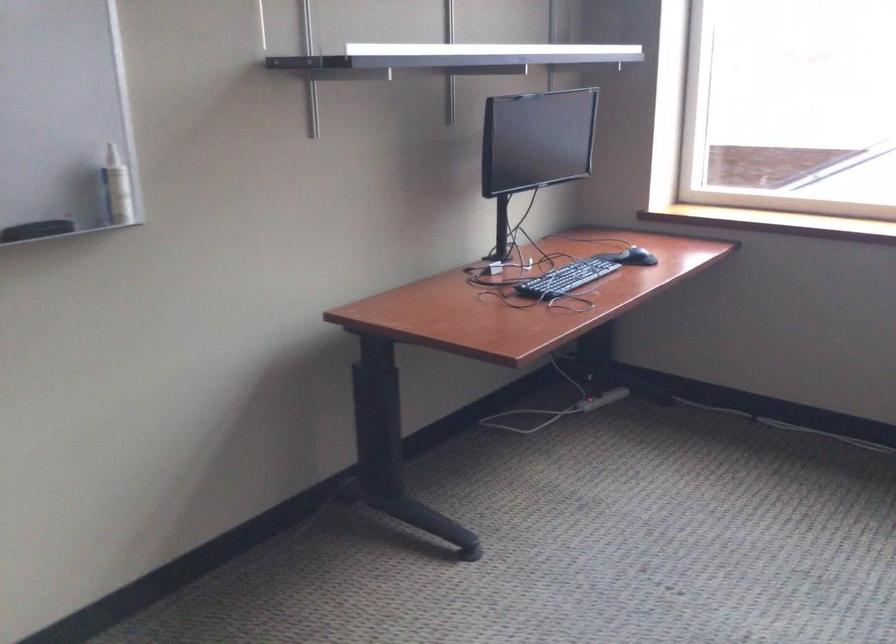
This screenshot has height=644, width=896. What do you see at coordinates (565, 279) in the screenshot? I see `a black keyboard` at bounding box center [565, 279].